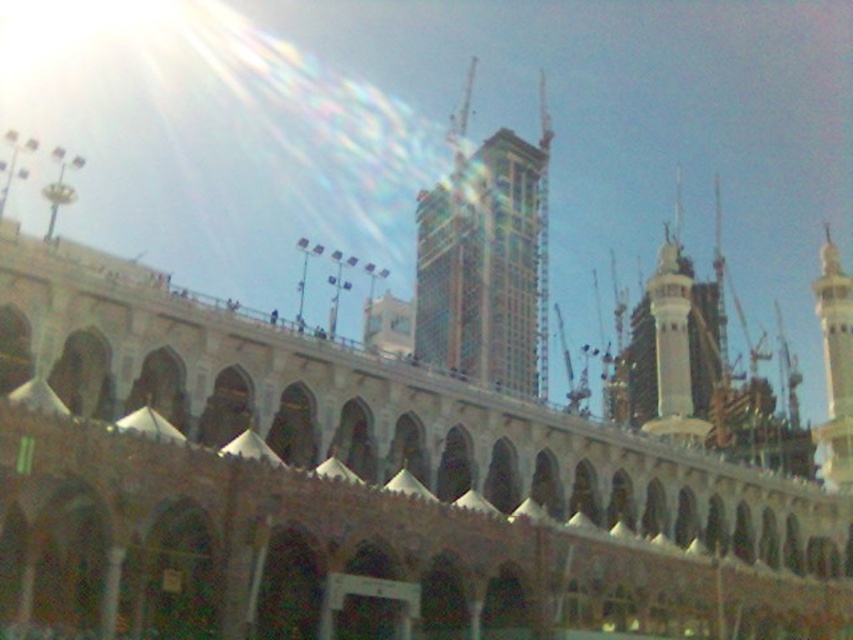
What are the coordinates of the green mosaic tower at center?

The green mosaic tower at center is located at coordinates point (486, 262).

You are standing at the point labeled point [486,262] in the image. What structure are you currently located on?

The point labeled point [486,262] is on the green mosaic tower at center.